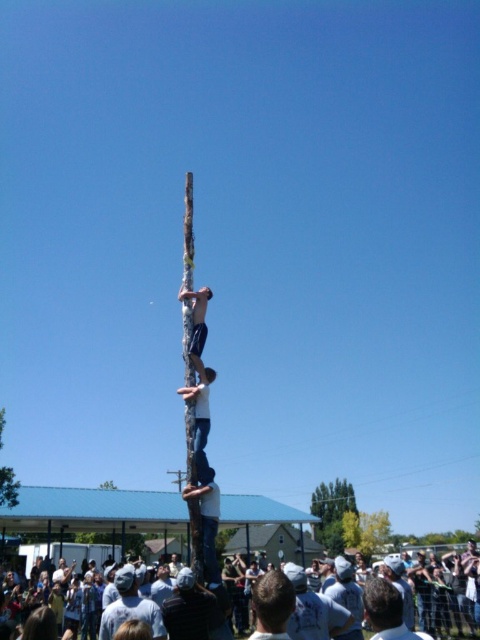
Is white cotton crowd at lower center wider than white cotton shirt at lower center?

Indeed, white cotton crowd at lower center has a greater width compared to white cotton shirt at lower center.

Does point (300, 592) come in front of point (335, 634)?

Yes, point (300, 592) is in front of point (335, 634).

Find the location of `white cotton crowd at lower center`. white cotton crowd at lower center is located at coordinates (319, 616).

Is white cotton crowd at lower center taller than light brown hair at center?

No, white cotton crowd at lower center is not taller than light brown hair at center.

Is white cotton crowd at lower center to the right of light brown hair at center from the viewer's perspective?

In fact, white cotton crowd at lower center is to the left of light brown hair at center.

Identify the location of white cotton crowd at lower center. The width and height of the screenshot is (480, 640). click(319, 616).

Where is `white cotton crowd at lower center`? This screenshot has width=480, height=640. white cotton crowd at lower center is located at coordinates (319, 616).

At what (x,y) coordinates should I click in order to perform the action: click on smooth wood totem pole at center. Please return your answer as a coordinate pair (x, y). Looking at the image, I should click on (188, 234).

What do you see at coordinates (188, 234) in the screenshot?
I see `smooth wood totem pole at center` at bounding box center [188, 234].

You are a GUI agent. You are given a task and a screenshot of the screen. Output one action in this format:
    pyautogui.click(x=<x>, y=<y>)
    Task: Click on the smooth wood totem pole at center
    This screenshot has height=640, width=480.
    Given the screenshot: What is the action you would take?
    pyautogui.click(x=188, y=234)

I want to click on smooth wood totem pole at center, so click(x=188, y=234).